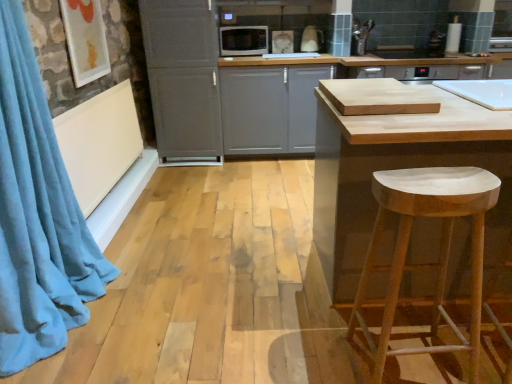
Question: Is white matte cabinet at center, which is counted as the 1th cabinetry, starting from the right, closer to the viewer compared to white glossy toaster at upper center, which appears as the 1th appliance when viewed from the right?

Choices:
 (A) yes
 (B) no

Answer: (A)

Question: Is white matte cabinet at center, which is counted as the 1th cabinetry, starting from the right, not inside white glossy toaster at upper center, placed as the 2th appliance when sorted from left to right?

Choices:
 (A) yes
 (B) no

Answer: (A)

Question: From the image's perspective, does white matte cabinet at center, which is counted as the second cabinetry, starting from the left, appear lower than white glossy toaster at upper center, placed as the 2th appliance when sorted from left to right?

Choices:
 (A) no
 (B) yes

Answer: (B)

Question: Is there a large distance between white matte cabinet at center, which is counted as the second cabinetry, starting from the left, and white glossy toaster at upper center, which appears as the 1th appliance when viewed from the right?

Choices:
 (A) no
 (B) yes

Answer: (A)

Question: Does white matte cabinet at center, which is counted as the 1th cabinetry, starting from the right, have a larger size compared to white glossy toaster at upper center, which appears as the 1th appliance when viewed from the right?

Choices:
 (A) no
 (B) yes

Answer: (B)

Question: Considering the positions of blue velvet curtain at left and white glossy toaster at upper center, placed as the 2th appliance when sorted from left to right, in the image, is blue velvet curtain at left taller or shorter than white glossy toaster at upper center, placed as the 2th appliance when sorted from left to right,?

Choices:
 (A) tall
 (B) short

Answer: (A)

Question: Does point (65, 168) appear closer or farther from the camera than point (304, 43)?

Choices:
 (A) closer
 (B) farther

Answer: (A)

Question: From the image's perspective, is blue velvet curtain at left positioned above or below white glossy toaster at upper center, which appears as the 1th appliance when viewed from the right?

Choices:
 (A) above
 (B) below

Answer: (B)

Question: In terms of width, does blue velvet curtain at left look wider or thinner when compared to white glossy toaster at upper center, which appears as the 1th appliance when viewed from the right?

Choices:
 (A) wide
 (B) thin

Answer: (A)

Question: From the image's perspective, is white matte stool at lower right positioned above or below blue velvet curtain at left?

Choices:
 (A) below
 (B) above

Answer: (A)

Question: From a real-world perspective, is white matte stool at lower right above or below blue velvet curtain at left?

Choices:
 (A) below
 (B) above

Answer: (A)

Question: Looking at their shapes, would you say white matte stool at lower right is wider or thinner than blue velvet curtain at left?

Choices:
 (A) wide
 (B) thin

Answer: (B)

Question: Considering the positions of white matte stool at lower right and blue velvet curtain at left in the image, is white matte stool at lower right bigger or smaller than blue velvet curtain at left?

Choices:
 (A) big
 (B) small

Answer: (B)

Question: In the image, is white glossy toaster at upper center, which appears as the 1th appliance when viewed from the right, on the left side or the right side of white matte stool at lower right?

Choices:
 (A) left
 (B) right

Answer: (A)

Question: Is white glossy toaster at upper center, placed as the 2th appliance when sorted from left to right, inside or outside of white matte stool at lower right?

Choices:
 (A) outside
 (B) inside

Answer: (A)